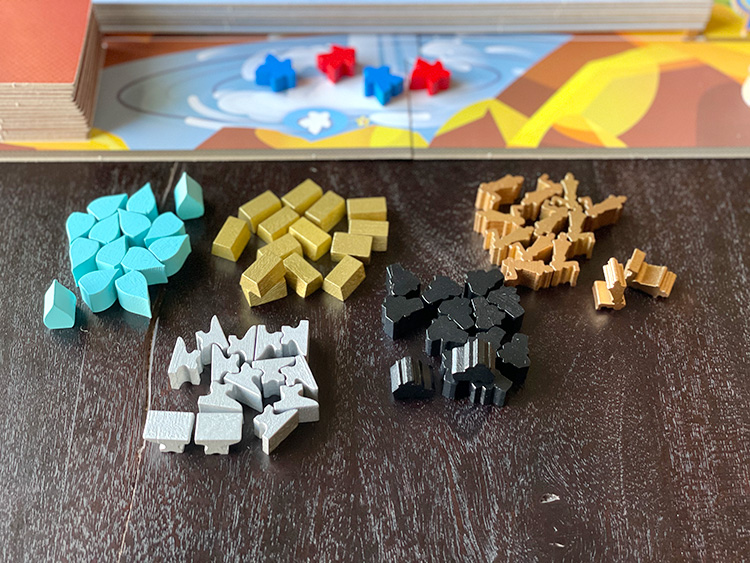
Find the location of a particular element. dark brown table top is located at coordinates (596, 444).